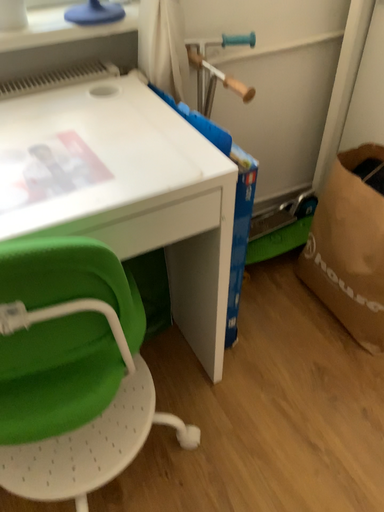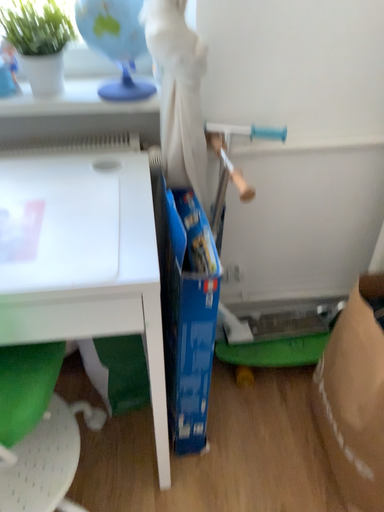
Question: How did the camera likely rotate when shooting the video?

Choices:
 (A) rotated upward
 (B) rotated downward

Answer: (A)